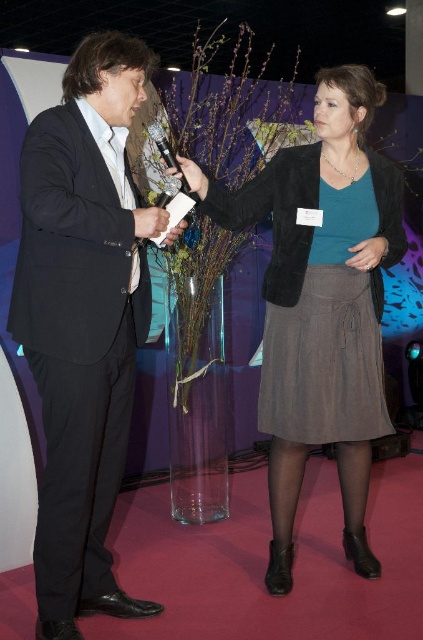
You are standing at the bottom left corner of the image. You want to walk directly towards the velvet black jacket at center. Which direction should you turn to face the jacket?

Since the velvet black jacket at center is located at point coordinates of [321,305], you should turn to face northeast to reach it.

You are a photographer setting up for an event and need to ensure that both the black matte suit at left and the velvet black jacket at center are visible in the frame. Given their height difference, which one might require you to adjust your camera angle to capture properly?

The black matte suit at left is much taller than the velvet black jacket at center, so you might need to lower the camera angle to ensure the taller suit is fully visible while still capturing the jacket.